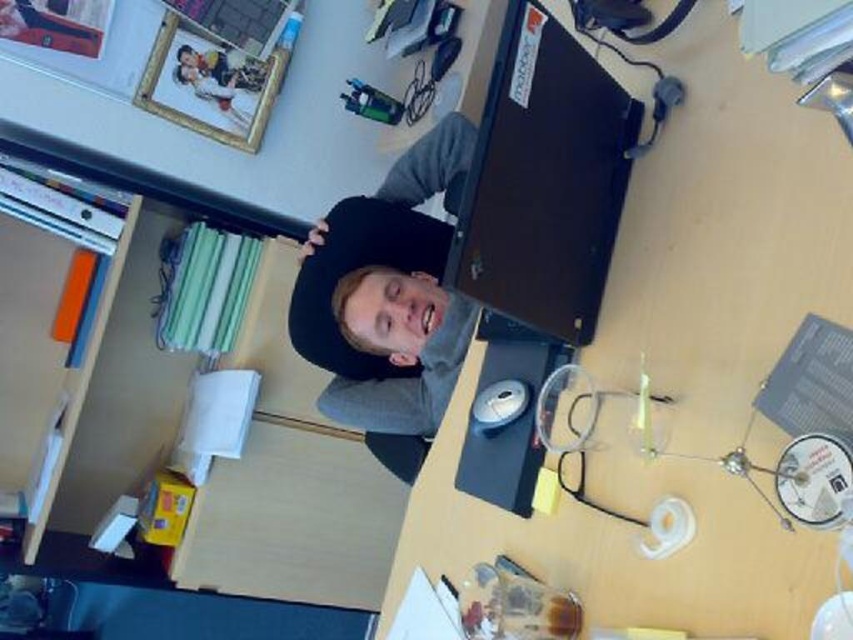
Does matte black laptop at upper center lie behind black matte laptop at upper center?

That is False.

Image resolution: width=853 pixels, height=640 pixels. Describe the element at coordinates (723, 241) in the screenshot. I see `matte black laptop at upper center` at that location.

At what (x,y) coordinates should I click in order to perform the action: click on matte black laptop at upper center. Please return your answer as a coordinate pair (x, y). Image resolution: width=853 pixels, height=640 pixels. Looking at the image, I should click on (723, 241).

Is point (706, 243) more distant than point (431, 163)?

No, (706, 243) is in front of (431, 163).

Who is more forward, (836, 241) or (403, 420)?

Point (836, 241)

Is point (497, 524) positioned after point (390, 308)?

No, (497, 524) is closer to viewer.

The height and width of the screenshot is (640, 853). Find the location of `matte black laptop at upper center`. matte black laptop at upper center is located at coordinates (723, 241).

Looking at this image, who is more forward, (480, 188) or (428, 275)?

Point (480, 188)

Locate an element on the screen. The height and width of the screenshot is (640, 853). black matte laptop at upper center is located at coordinates (544, 180).

Is point (505, 160) positioned behind point (387, 426)?

No, (505, 160) is in front of (387, 426).

Image resolution: width=853 pixels, height=640 pixels. What are the coordinates of `black matte laptop at upper center` in the screenshot? It's located at (544, 180).